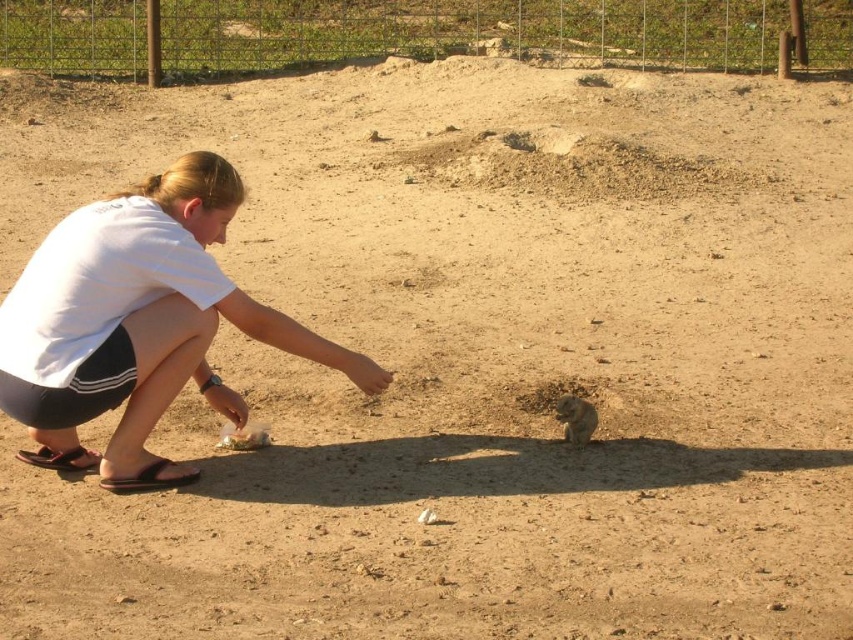
Between point (543, 384) and point (570, 420), which one is positioned behind?

The point (543, 384) is behind.

Is brown dirt hole at center closer to the viewer compared to fuzzy brown squirrel at lower center?

No.

What do you see at coordinates (552, 394) in the screenshot? I see `brown dirt hole at center` at bounding box center [552, 394].

Where is `brown dirt hole at center`? brown dirt hole at center is located at coordinates (552, 394).

Is point (190, 467) more distant than point (543, 406)?

No, it is not.

Can you confirm if white matte shirt at center is positioned above brown dirt hole at center?

Correct, white matte shirt at center is located above brown dirt hole at center.

I want to click on white matte shirt at center, so click(137, 323).

Is white matte shirt at center to the right of fuzzy brown squirrel at lower center from the viewer's perspective?

Incorrect, white matte shirt at center is not on the right side of fuzzy brown squirrel at lower center.

Is white matte shirt at center to the left of fuzzy brown squirrel at lower center from the viewer's perspective?

Indeed, white matte shirt at center is positioned on the left side of fuzzy brown squirrel at lower center.

The width and height of the screenshot is (853, 640). I want to click on white matte shirt at center, so click(x=137, y=323).